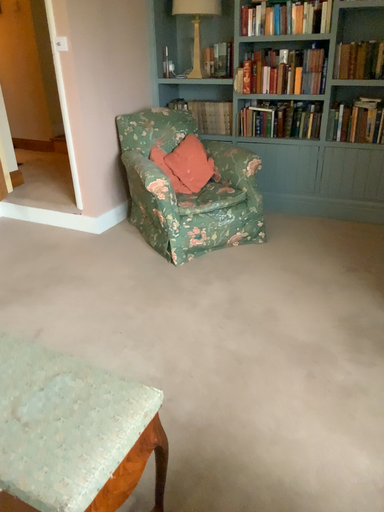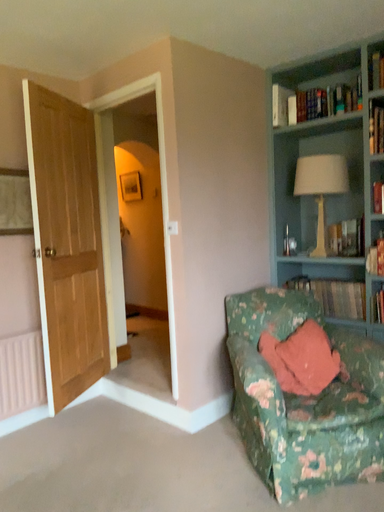
Question: Which way did the camera rotate in the video?

Choices:
 (A) rotated upward
 (B) rotated downward

Answer: (A)